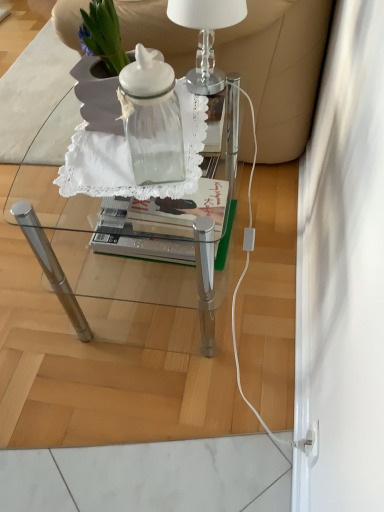
Question: Relative to transparent glass jar at center, is transparent glass table at center in front or behind?

Choices:
 (A) front
 (B) behind

Answer: (B)

Question: From the image's perspective, is transparent glass table at center above or below transparent glass jar at center?

Choices:
 (A) below
 (B) above

Answer: (A)

Question: Which object is positioned closest to the transparent glass table at center?

Choices:
 (A) white leather armchair at upper center
 (B) clear glass table lamp at upper center
 (C) transparent glass jar at center

Answer: (C)

Question: Estimate the real-world distances between objects in this image. Which object is farther from the clear glass table lamp at upper center?

Choices:
 (A) white leather armchair at upper center
 (B) transparent glass jar at center
 (C) transparent glass table at center

Answer: (C)